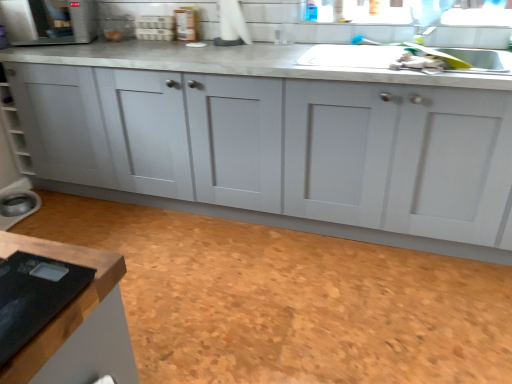
Question: Should I look upward or downward to see white matte cabinet at center?

Choices:
 (A) down
 (B) up

Answer: (B)

Question: Does brown cork floor at lower center have a greater height compared to matte white kettle at lower left, arranged as the 4th appliance when viewed from the top?

Choices:
 (A) no
 (B) yes

Answer: (A)

Question: Could matte white kettle at lower left, arranged as the 4th appliance when viewed from the right, be considered to be inside brown cork floor at lower center?

Choices:
 (A) yes
 (B) no

Answer: (B)

Question: Does brown cork floor at lower center turn towards matte white kettle at lower left, the 1th appliance from the bottom?

Choices:
 (A) yes
 (B) no

Answer: (B)

Question: Can you confirm if brown cork floor at lower center is positioned to the left of matte white kettle at lower left, arranged as the 4th appliance when viewed from the top?

Choices:
 (A) no
 (B) yes

Answer: (A)

Question: Does brown cork floor at lower center have a lesser width compared to matte white kettle at lower left, arranged as the 4th appliance when viewed from the top?

Choices:
 (A) yes
 (B) no

Answer: (B)

Question: Is brown cork floor at lower center located outside matte white kettle at lower left, arranged as the 4th appliance when viewed from the top?

Choices:
 (A) no
 (B) yes

Answer: (B)

Question: Considering the relative sizes of white matte cabinet at center and matte brown jar at upper center, the 1th appliance positioned from the right, in the image provided, is white matte cabinet at center thinner than matte brown jar at upper center, the 1th appliance positioned from the right,?

Choices:
 (A) yes
 (B) no

Answer: (B)

Question: Does white matte cabinet at center have a greater width compared to matte brown jar at upper center, placed as the 4th appliance when sorted from left to right?

Choices:
 (A) no
 (B) yes

Answer: (B)

Question: Considering the relative positions of white matte cabinet at center and matte brown jar at upper center, the 1th appliance positioned from the right, in the image provided, is white matte cabinet at center to the right of matte brown jar at upper center, the 1th appliance positioned from the right, from the viewer's perspective?

Choices:
 (A) yes
 (B) no

Answer: (A)

Question: Would you say matte brown jar at upper center, positioned as the 2th appliance in bottom-to-top order, is part of white matte cabinet at center's contents?

Choices:
 (A) yes
 (B) no

Answer: (B)

Question: Is the position of white matte cabinet at center more distant than that of matte brown jar at upper center, positioned as the third appliance in top-to-bottom order?

Choices:
 (A) no
 (B) yes

Answer: (A)

Question: Could you tell me if white matte cabinet at center is facing matte brown jar at upper center, the 1th appliance positioned from the right?

Choices:
 (A) yes
 (B) no

Answer: (B)

Question: From a real-world perspective, is white plastic egg carton at upper center, the 2th appliance when ordered from right to left, physically below brown cork floor at lower center?

Choices:
 (A) no
 (B) yes

Answer: (A)